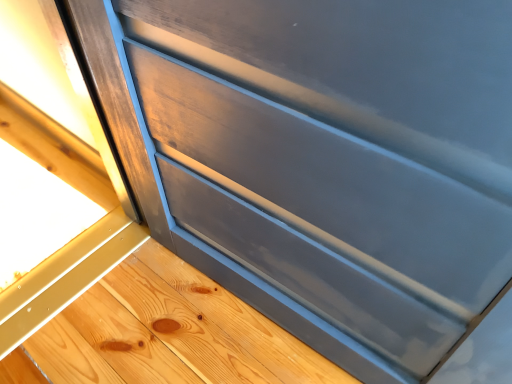
What do you see at coordinates (170, 332) in the screenshot?
I see `matte gray plywood at lower right` at bounding box center [170, 332].

The height and width of the screenshot is (384, 512). In order to click on matte gray plywood at lower right in this screenshot , I will do `click(170, 332)`.

Locate an element on the screen. matte gray plywood at lower right is located at coordinates (170, 332).